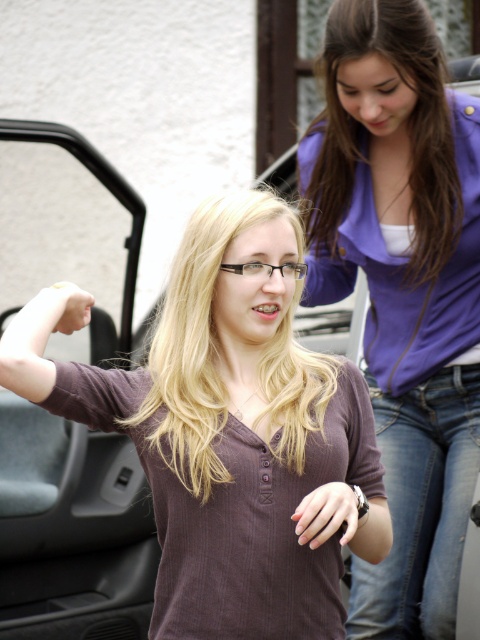
Question: Estimate the real-world distances between objects in this image. Which object is farther from the matte black ring at lower center?

Choices:
 (A) jeans at lower right
 (B) matte brown shirt at lower left
 (C) matte skin hand at lower left

Answer: (C)

Question: Does purple soft fabric jacket at upper right appear over matte skin hand at lower left?

Choices:
 (A) no
 (B) yes

Answer: (A)

Question: Which object is the farthest from the purple soft fabric jacket at upper right?

Choices:
 (A) purple soft fabric arm at upper right
 (B) jeans at lower right
 (C) matte skin hand at lower left

Answer: (C)

Question: Which point is farther from the camera taking this photo?

Choices:
 (A) (28, 580)
 (B) (324, 284)
 (C) (66, 298)

Answer: (A)

Question: Is jeans at lower right bigger than matte brown shirt at lower left?

Choices:
 (A) no
 (B) yes

Answer: (B)

Question: Does purple soft shirt at upper right come behind jeans at lower right?

Choices:
 (A) no
 (B) yes

Answer: (A)